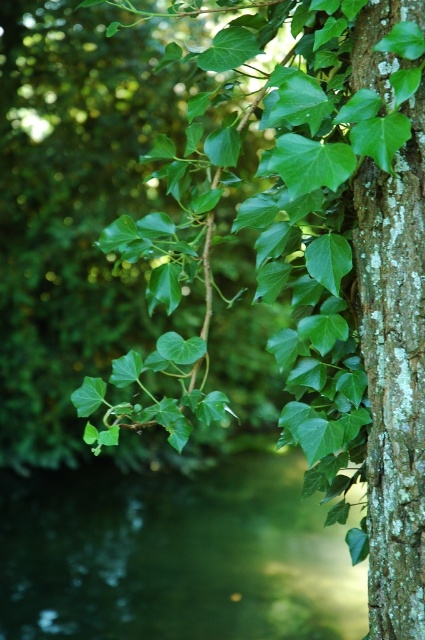
Who is lower down, green liquid at lower left or green rough bark tree trunk at right?

green liquid at lower left is below.

From the picture: Is green liquid at lower left shorter than green rough bark tree trunk at right?

Correct, green liquid at lower left is not as tall as green rough bark tree trunk at right.

What are the coordinates of `green liquid at lower left` in the screenshot? It's located at (175, 556).

What are the coordinates of `green liquid at lower left` in the screenshot? It's located at (175, 556).